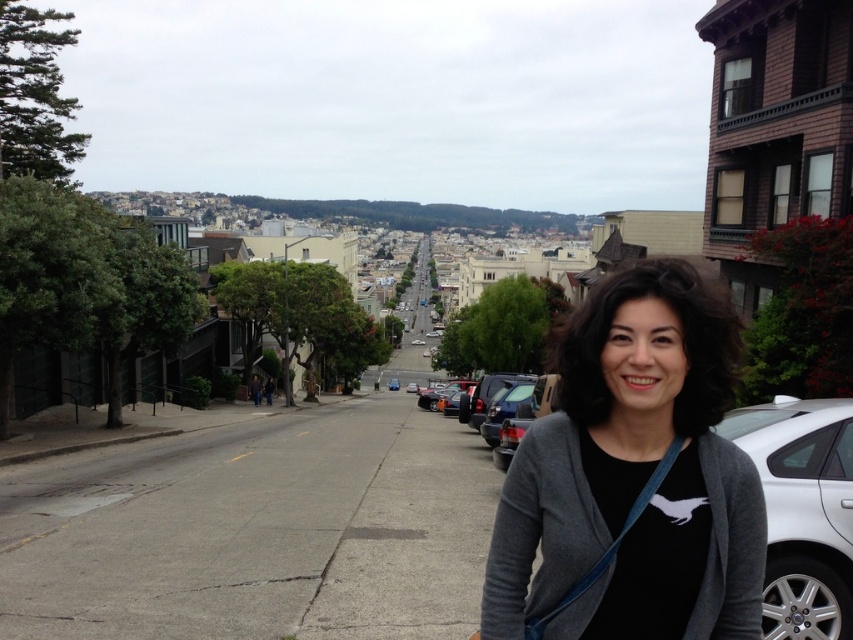
You are standing at the point labeled point (792, 460) in the image. If you want to walk towards the point labeled point (680, 285), which direction should you move relative to your current position?

You should move forward because point (680, 285) is in front of point (792, 460).

You are a delivery person trying to locate a package left at a specific point on the street. The package is at the point marked by the coordinates point (634, 476). Describe the location of this point relative to the gray fabric at center in the image.

The point marked by the coordinates point (634, 476) is exactly where the gray fabric at center is located.